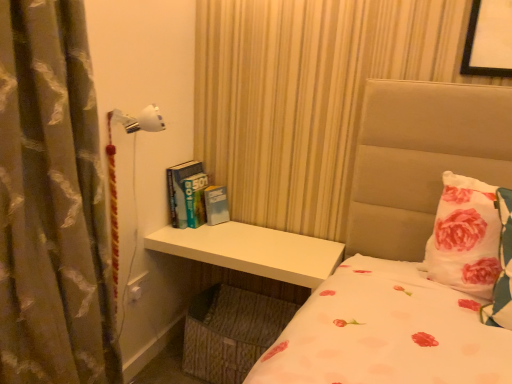
Identify the location of vacant point above white glossy table at lower center (from a real-world perspective). pyautogui.click(x=268, y=240).